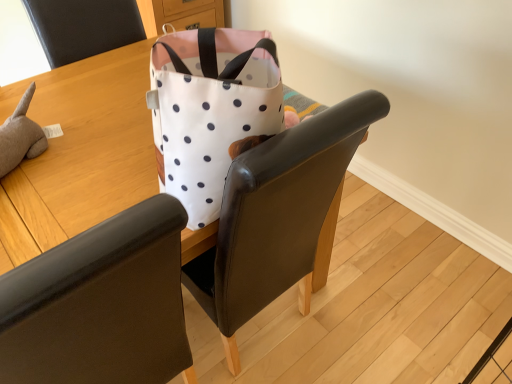
Describe the element at coordinates (83, 27) in the screenshot. The height and width of the screenshot is (384, 512). I see `matte black chair at upper left, which is the first chair in top-to-bottom order` at that location.

I want to click on matte black chair at upper left, which ranks as the 2th chair in bottom-to-top order, so click(83, 27).

Locate an element on the screen. This screenshot has width=512, height=384. white fabric chair at upper center, the first chair when ordered from bottom to top is located at coordinates (100, 304).

Locate an element on the screen. The width and height of the screenshot is (512, 384). matte black chair at upper left, which ranks as the 2th chair in bottom-to-top order is located at coordinates (83, 27).

Between matte black chair at upper left, which is the first chair in top-to-bottom order, and white fabric chair at upper center, the first chair when ordered from bottom to top, which one has less height?

Answer: Standing shorter between the two is matte black chair at upper left, which is the first chair in top-to-bottom order.

Considering the positions of objects matte black chair at upper left, which ranks as the 2th chair in bottom-to-top order, and white fabric chair at upper center, arranged as the 2th chair when viewed from the top, in the image provided, who is more to the right, matte black chair at upper left, which ranks as the 2th chair in bottom-to-top order, or white fabric chair at upper center, arranged as the 2th chair when viewed from the top,?

white fabric chair at upper center, arranged as the 2th chair when viewed from the top.

Does matte black chair at upper left, which ranks as the 2th chair in bottom-to-top order, contain white fabric chair at upper center, arranged as the 2th chair when viewed from the top?

No, white fabric chair at upper center, arranged as the 2th chair when viewed from the top, is not a part of matte black chair at upper left, which ranks as the 2th chair in bottom-to-top order.

Does matte black chair at upper left, which ranks as the 2th chair in bottom-to-top order, have a lesser width compared to white fabric chair at upper center, the first chair when ordered from bottom to top?

Yes.

From a real-world perspective, is white fabric chair at upper center, arranged as the 2th chair when viewed from the top, under matte black chair at upper left, which is the first chair in top-to-bottom order?

Indeed, from a real-world perspective, white fabric chair at upper center, arranged as the 2th chair when viewed from the top, is positioned beneath matte black chair at upper left, which is the first chair in top-to-bottom order.

Can you confirm if white fabric chair at upper center, the first chair when ordered from bottom to top, is bigger than matte black chair at upper left, which is the first chair in top-to-bottom order?

Yes, white fabric chair at upper center, the first chair when ordered from bottom to top, is bigger than matte black chair at upper left, which is the first chair in top-to-bottom order.

Considering the positions of points (24, 267) and (126, 19), is point (24, 267) closer to camera compared to point (126, 19)?

Yes, point (24, 267) is in front of point (126, 19).

Is white fabric chair at upper center, the first chair when ordered from bottom to top, wider than matte black chair at upper left, which ranks as the 2th chair in bottom-to-top order?

Yes, white fabric chair at upper center, the first chair when ordered from bottom to top, is wider than matte black chair at upper left, which ranks as the 2th chair in bottom-to-top order.

Which is correct: white fabric bag at upper center is inside matte black chair at upper left, which ranks as the 2th chair in bottom-to-top order, or outside of it?

white fabric bag at upper center is not enclosed by matte black chair at upper left, which ranks as the 2th chair in bottom-to-top order.

Consider the image. Does white fabric bag at upper center have a lesser height compared to matte black chair at upper left, which is the first chair in top-to-bottom order?

Incorrect, the height of white fabric bag at upper center does not fall short of that of matte black chair at upper left, which is the first chair in top-to-bottom order.

Which is behind, white fabric bag at upper center or matte black chair at upper left, which is the first chair in top-to-bottom order?

matte black chair at upper left, which is the first chair in top-to-bottom order, is further away from the camera.

From a real-world perspective, is white fabric bag at upper center physically below matte black chair at upper left, which is the first chair in top-to-bottom order?

Correct, in the physical world, white fabric bag at upper center is lower than matte black chair at upper left, which is the first chair in top-to-bottom order.

Between white fabric bag at upper center and white fabric chair at upper center, arranged as the 2th chair when viewed from the top, which one has more height?

white fabric chair at upper center, arranged as the 2th chair when viewed from the top.

In the scene shown: Which is behind, white fabric bag at upper center or white fabric chair at upper center, the first chair when ordered from bottom to top?

white fabric bag at upper center is more distant.

Between white fabric bag at upper center and white fabric chair at upper center, arranged as the 2th chair when viewed from the top, which one has larger width?

Wider between the two is white fabric bag at upper center.

Would you say white fabric bag at upper center is to the left or to the right of white fabric chair at upper center, arranged as the 2th chair when viewed from the top, in the picture?

white fabric bag at upper center is positioned on white fabric chair at upper center, arranged as the 2th chair when viewed from the top,'s right side.

Looking at this image, is white fabric chair at upper center, the first chair when ordered from bottom to top, bigger than white fabric bag at upper center?

Incorrect, white fabric chair at upper center, the first chair when ordered from bottom to top, is not larger than white fabric bag at upper center.

Based on the photo, does white fabric chair at upper center, the first chair when ordered from bottom to top, have a greater width compared to white fabric bag at upper center?

No, white fabric chair at upper center, the first chair when ordered from bottom to top, is not wider than white fabric bag at upper center.

Is white fabric chair at upper center, the first chair when ordered from bottom to top, aimed at white fabric bag at upper center?

Yes, white fabric chair at upper center, the first chair when ordered from bottom to top, faces towards white fabric bag at upper center.

Is matte black chair at upper left, which ranks as the 2th chair in bottom-to-top order, oriented towards white fabric bag at upper center?

No, matte black chair at upper left, which ranks as the 2th chair in bottom-to-top order, is not turned towards white fabric bag at upper center.

From the image's perspective, would you say matte black chair at upper left, which ranks as the 2th chair in bottom-to-top order, is shown under white fabric bag at upper center?

Actually, matte black chair at upper left, which ranks as the 2th chair in bottom-to-top order, appears above white fabric bag at upper center in the image.

Between matte black chair at upper left, which ranks as the 2th chair in bottom-to-top order, and white fabric bag at upper center, which one appears on the right side from the viewer's perspective?

Positioned to the right is white fabric bag at upper center.

Is matte black chair at upper left, which ranks as the 2th chair in bottom-to-top order, taller or shorter than white fabric bag at upper center?

Clearly, matte black chair at upper left, which ranks as the 2th chair in bottom-to-top order, is shorter compared to white fabric bag at upper center.

In order to click on chair on the left side of white fabric chair at upper center, the first chair when ordered from bottom to top in this screenshot , I will do `click(83, 27)`.

Locate an element on the screen. The image size is (512, 384). chair behind the white fabric chair at upper center, arranged as the 2th chair when viewed from the top is located at coordinates (83, 27).

When comparing their distances from matte black chair at upper left, which ranks as the 2th chair in bottom-to-top order, does white fabric bag at upper center or white fabric chair at upper center, the first chair when ordered from bottom to top, seem closer?

white fabric bag at upper center lies closer to matte black chair at upper left, which ranks as the 2th chair in bottom-to-top order, than the other object.

When comparing their distances from white fabric bag at upper center, does white fabric chair at upper center, arranged as the 2th chair when viewed from the top, or matte black chair at upper left, which is the first chair in top-to-bottom order, seem further?

Among the two, white fabric chair at upper center, arranged as the 2th chair when viewed from the top, is located further to white fabric bag at upper center.

Based on their spatial positions, is white fabric bag at upper center or matte black chair at upper left, which ranks as the 2th chair in bottom-to-top order, further from white fabric chair at upper center, arranged as the 2th chair when viewed from the top?

Among the two, matte black chair at upper left, which ranks as the 2th chair in bottom-to-top order, is located further to white fabric chair at upper center, arranged as the 2th chair when viewed from the top.

Based on their spatial positions, is matte black chair at upper left, which is the first chair in top-to-bottom order, or white fabric bag at upper center further from white fabric chair at upper center, arranged as the 2th chair when viewed from the top?

matte black chair at upper left, which is the first chair in top-to-bottom order, is further to white fabric chair at upper center, arranged as the 2th chair when viewed from the top.

Estimate the real-world distances between objects in this image. Which object is closer to matte black chair at upper left, which ranks as the 2th chair in bottom-to-top order, white fabric chair at upper center, arranged as the 2th chair when viewed from the top, or white fabric bag at upper center?

white fabric bag at upper center.

Based on their spatial positions, is matte black chair at upper left, which ranks as the 2th chair in bottom-to-top order, or white fabric chair at upper center, the first chair when ordered from bottom to top, further from white fabric bag at upper center?

The object further to white fabric bag at upper center is white fabric chair at upper center, the first chair when ordered from bottom to top.

Identify the location of table between matte black chair at upper left, which is the first chair in top-to-bottom order, and white fabric chair at upper center, the first chair when ordered from bottom to top, from top to bottom. This screenshot has width=512, height=384. pos(81,154).